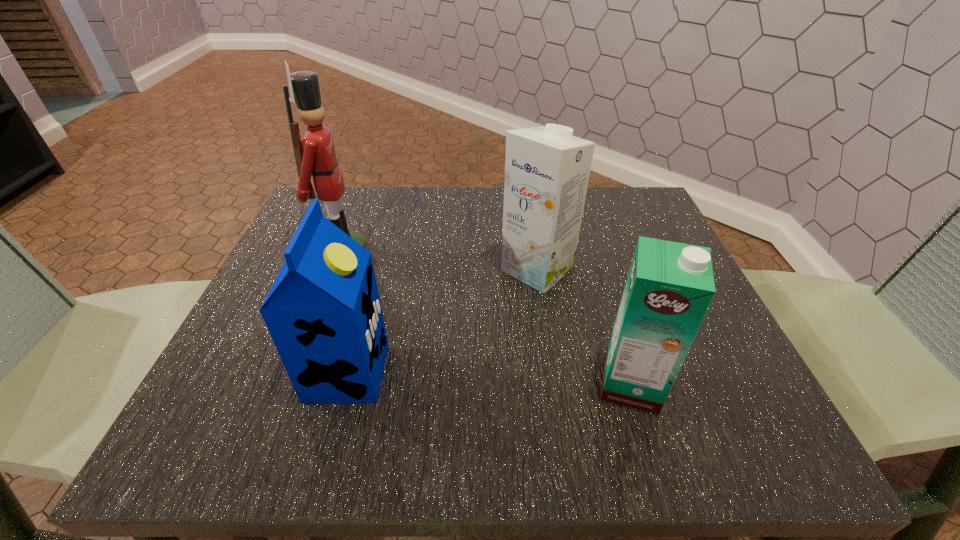
At what (x,y) coordinates should I click in order to perform the action: click on vacant space that is in between the farthest carton and the leftmost carton. Please return your answer as a coordinate pair (x, y). Image resolution: width=960 pixels, height=540 pixels. Looking at the image, I should click on (443, 321).

Where is `vacant point located between the farthest carton and the leftmost carton`? The width and height of the screenshot is (960, 540). vacant point located between the farthest carton and the leftmost carton is located at coordinates (443, 321).

At what (x,y) coordinates should I click in order to perform the action: click on vacant region between the farthest carton and the leftmost carton. Please return your answer as a coordinate pair (x, y). This screenshot has height=540, width=960. Looking at the image, I should click on (443, 321).

The image size is (960, 540). I want to click on empty space that is in between the leftmost carton and the farthest carton, so pos(443,321).

You are a GUI agent. You are given a task and a screenshot of the screen. Output one action in this format:
    pyautogui.click(x=<x>, y=<y>)
    Task: Click on the second closest object to the farthest carton
    The width and height of the screenshot is (960, 540).
    Given the screenshot: What is the action you would take?
    pyautogui.click(x=323, y=312)

Point out which object is positioned as the nearest to the tallest object. Please provide its 2D coordinates. Your answer should be formatted as a tuple, i.e. [(x, y)], where the tuple contains the x and y coordinates of a point satisfying the conditions above.

[(323, 312)]

Identify which carton is the nearest to the tallest object. Please provide its 2D coordinates. Your answer should be formatted as a tuple, i.e. [(x, y)], where the tuple contains the x and y coordinates of a point satisfying the conditions above.

[(323, 312)]

The height and width of the screenshot is (540, 960). Identify the location of the closest carton relative to the nutcracker. (323, 312).

In order to click on free point that satisfies the following two spatial constraints: 1. on the front-facing side of the tallest object; 2. on the back side of the farthest carton in this screenshot , I will do `click(338, 269)`.

The image size is (960, 540). Find the location of `vacant space that satisfies the following two spatial constraints: 1. on the front-facing side of the farthest carton; 2. on the right side of the tallest object`. vacant space that satisfies the following two spatial constraints: 1. on the front-facing side of the farthest carton; 2. on the right side of the tallest object is located at coordinates (338, 269).